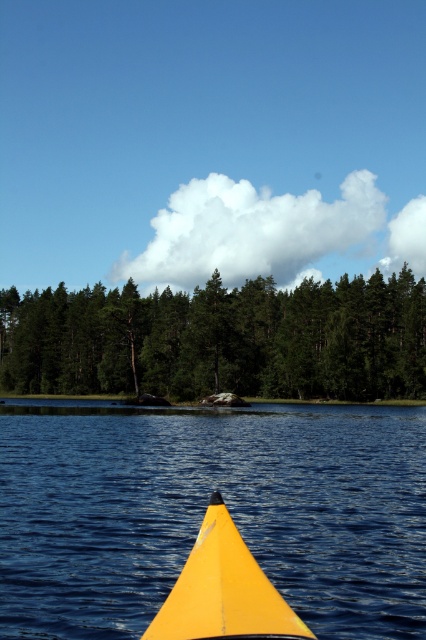
Is green matte trees at center to the right of shiny yellow canoe at center from the viewer's perspective?

In fact, green matte trees at center is to the left of shiny yellow canoe at center.

Does point (112, 358) lie behind point (169, 620)?

That is True.

I want to click on green matte trees at center, so click(221, 339).

Which is more to the right, yellow plastic water at lower center or green matte trees at center?

Positioned to the right is yellow plastic water at lower center.

Which is below, yellow plastic water at lower center or green matte trees at center?

yellow plastic water at lower center is below.

The width and height of the screenshot is (426, 640). I want to click on yellow plastic water at lower center, so click(x=204, y=509).

Find the location of a particular element. yellow plastic water at lower center is located at coordinates (204, 509).

Is yellow plastic water at lower center thinner than shiny yellow canoe at center?

No, yellow plastic water at lower center is not thinner than shiny yellow canoe at center.

Consider the image. Who is more forward, (310,468) or (230,547)?

Point (230,547) is in front.

Where is `yellow plastic water at lower center`? The height and width of the screenshot is (640, 426). yellow plastic water at lower center is located at coordinates (204, 509).